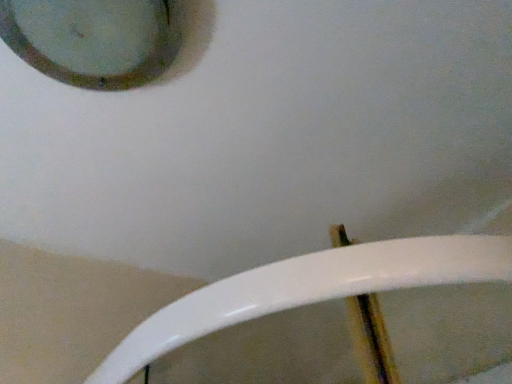
Locate an element on the screen. matte glass porthole at upper left is located at coordinates (93, 39).

Describe the element at coordinates (93, 39) in the screenshot. I see `matte glass porthole at upper left` at that location.

Based on the photo, measure the distance between matte glass porthole at upper left and camera.

The distance of matte glass porthole at upper left from camera is 61.17 centimeters.

The width and height of the screenshot is (512, 384). Identify the location of matte glass porthole at upper left. (93, 39).